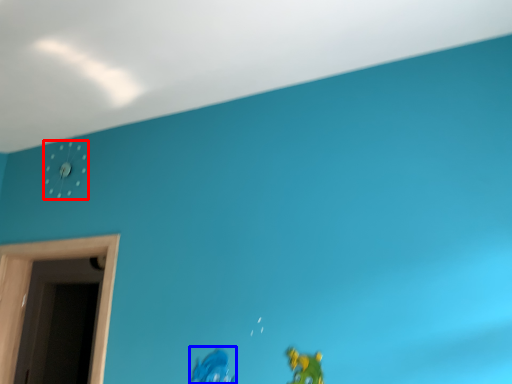
Question: Which object appears closest to the camera in this image, clock (highlighted by a red box) or toy (highlighted by a blue box)?

Choices:
 (A) clock
 (B) toy

Answer: (B)